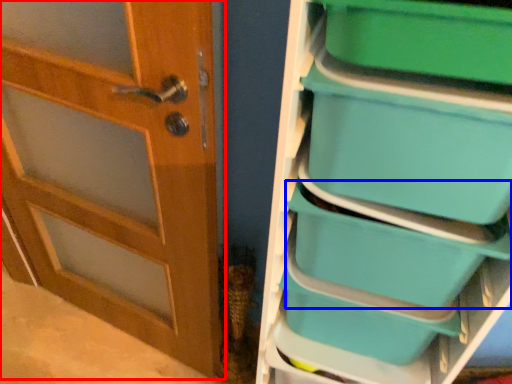
Question: Which object is closer to the camera taking this photo, door (highlighted by a red box) or storage box (highlighted by a blue box)?

Choices:
 (A) door
 (B) storage box

Answer: (A)